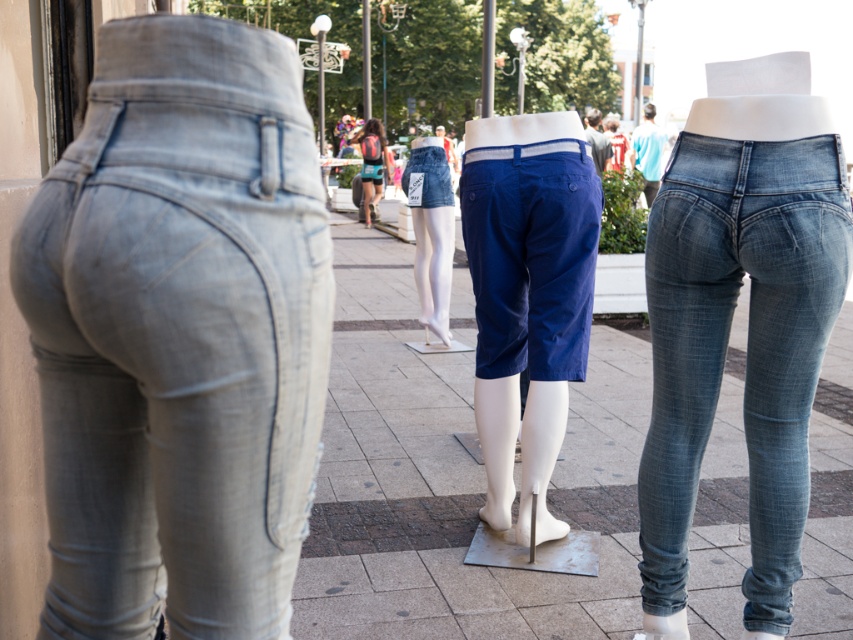
Which is more to the right, light gray denim jeans at left or blue cotton shorts at center?

blue cotton shorts at center is more to the right.

Consider the image. Measure the distance between point (68, 472) and camera.

The distance of point (68, 472) from camera is 1.66 meters.

Where is `light gray denim jeans at left`? Image resolution: width=853 pixels, height=640 pixels. light gray denim jeans at left is located at coordinates (178, 333).

Can you confirm if blue cotton shorts at center is positioned above denim shorts at center?

Incorrect, blue cotton shorts at center is not positioned above denim shorts at center.

Can you confirm if blue cotton shorts at center is taller than denim shorts at center?

In fact, blue cotton shorts at center may be shorter than denim shorts at center.

Where is `blue cotton shorts at center`? This screenshot has height=640, width=853. blue cotton shorts at center is located at coordinates (531, 257).

Which is below, smooth concrete pavement at center or blue cotton shorts at center?

Positioned lower is smooth concrete pavement at center.

What do you see at coordinates (454, 481) in the screenshot?
I see `smooth concrete pavement at center` at bounding box center [454, 481].

Who is more forward, [712,632] or [515,234]?

Point [712,632]

Find the location of a particular element. The width and height of the screenshot is (853, 640). smooth concrete pavement at center is located at coordinates click(x=454, y=481).